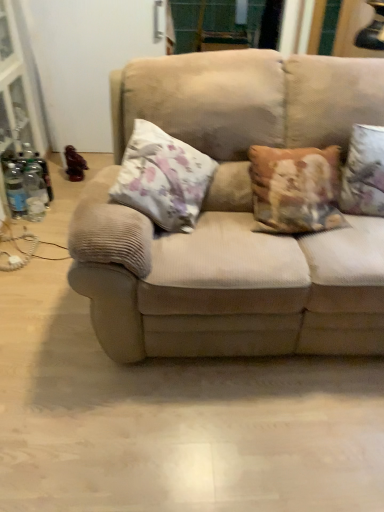
Question: Considering the positions of point click(213, 138) and point click(137, 202), is point click(213, 138) closer or farther from the camera than point click(137, 202)?

Choices:
 (A) closer
 (B) farther

Answer: (B)

Question: Considering the positions of beige corduroy couch at center and floral fabric pillow at center, the first pillow in the left-to-right sequence, in the image, is beige corduroy couch at center taller or shorter than floral fabric pillow at center, the first pillow in the left-to-right sequence,?

Choices:
 (A) tall
 (B) short

Answer: (A)

Question: Which object is positioned farthest from the beige corduroy couch at center?

Choices:
 (A) wooden statue at left
 (B) floral fabric pillow at right, acting as the 2th pillow starting from the left
 (C) floral fabric pillow at center, arranged as the second pillow when viewed from the right

Answer: (A)

Question: Which of these objects is positioned farthest from the beige corduroy couch at center?

Choices:
 (A) floral fabric pillow at center, arranged as the second pillow when viewed from the right
 (B) wooden statue at left
 (C) floral fabric pillow at right, acting as the 2th pillow starting from the left

Answer: (B)